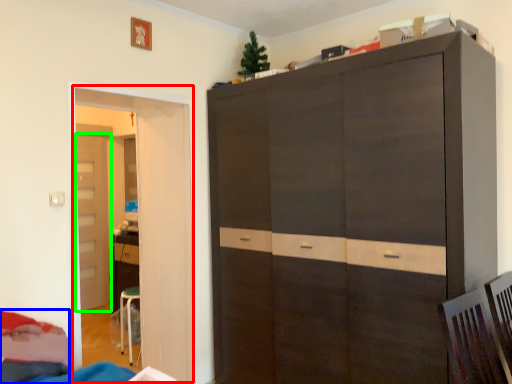
Question: Which object is the closest to the door (highlighted by a red box)? Choose among these: bed (highlighted by a blue box) or door (highlighted by a green box).

Choices:
 (A) bed
 (B) door

Answer: (A)